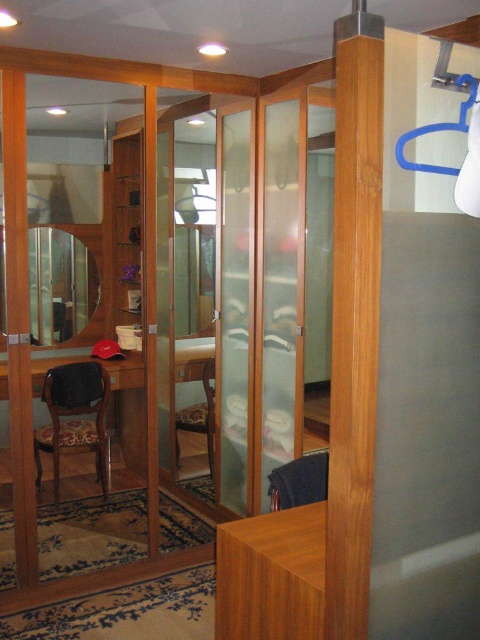
Is point (72, 243) positioned in front of point (176, 433)?

No.

Is matte wooden mirror at center above wooden chair at center?

Yes.

Is point (50, 275) more distant than point (205, 364)?

That is True.

This screenshot has height=640, width=480. I want to click on matte wooden mirror at center, so click(x=70, y=276).

Does wooden textured chair at left have a larger size compared to matte wooden mirror at center?

Yes.

Can you confirm if wooden textured chair at left is taller than matte wooden mirror at center?

In fact, wooden textured chair at left may be shorter than matte wooden mirror at center.

Does point (55, 410) come farther from viewer compared to point (29, 262)?

No, it is not.

Where is `wooden textured chair at left`? The height and width of the screenshot is (640, 480). wooden textured chair at left is located at coordinates (74, 419).

Locate an element on the screen. The image size is (480, 640). clear plastic screen door at upper right is located at coordinates (425, 364).

Between clear plastic screen door at upper right and matte wooden mirror at center, which one appears on the left side from the viewer's perspective?

From the viewer's perspective, matte wooden mirror at center appears more on the left side.

Image resolution: width=480 pixels, height=640 pixels. In order to click on clear plastic screen door at upper right in this screenshot , I will do `click(425, 364)`.